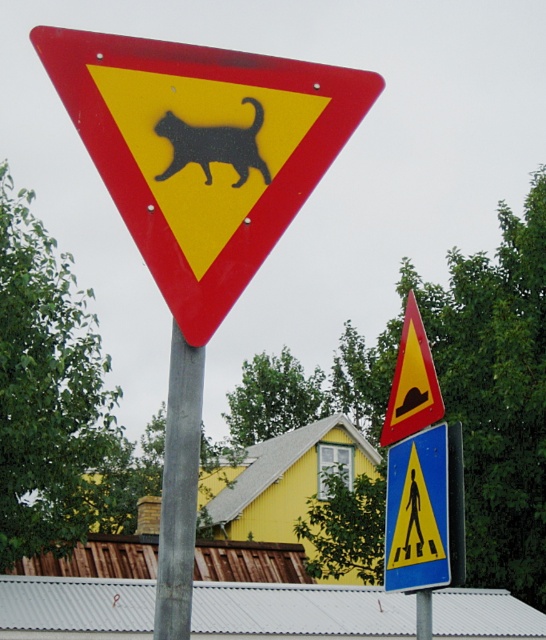
You are a driver approaching an intersection and see the metallic pole at center with several road signs. You need to determine if the yellow plastic pedestrian crossing sign at upper center is mounted higher than the pole itself. Can you confirm this based on the scene?

The metallic pole at center is taller than yellow plastic pedestrian crossing sign at upper center, so the pedestrian sign is not mounted higher than the pole itself.

Based on the photo, you are a pedestrian standing near the metallic pole at center. You want to cross the street and need to check the yellow plastic pedestrian crossing sign at upper center. Can you reach the sign without moving from your current position?

The metallic pole at center is closer to the viewer than the yellow plastic pedestrian crossing sign at upper center, so you cannot reach the sign without moving closer to it.